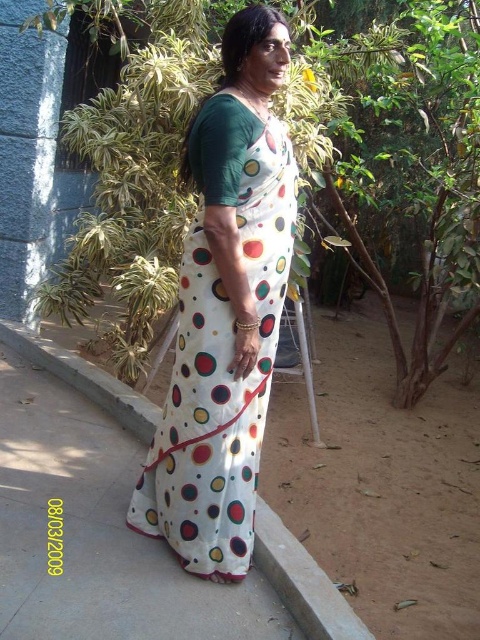
Does white dotted fabric dress at center have a lesser height compared to white fabric at center?

No, white dotted fabric dress at center is not shorter than white fabric at center.

This screenshot has height=640, width=480. What do you see at coordinates (220, 346) in the screenshot?
I see `white dotted fabric dress at center` at bounding box center [220, 346].

The height and width of the screenshot is (640, 480). Describe the element at coordinates (220, 346) in the screenshot. I see `white dotted fabric dress at center` at that location.

Find the location of a particular element. This screenshot has width=480, height=640. white dotted fabric dress at center is located at coordinates (220, 346).